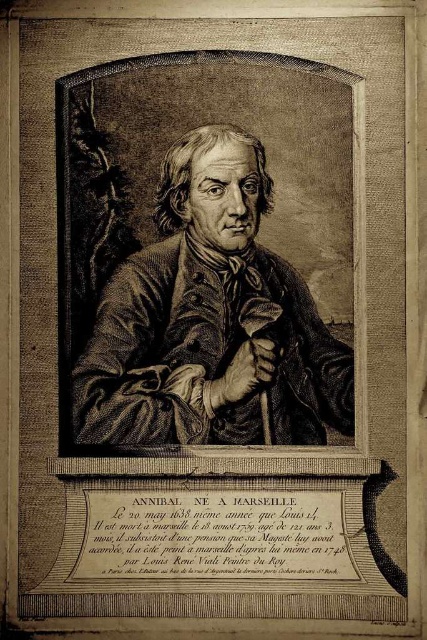
Question: Does etched paper portrait at center have a larger size compared to black paper text at center?

Choices:
 (A) no
 (B) yes

Answer: (B)

Question: Does etched paper portrait at center come in front of black paper text at center?

Choices:
 (A) no
 (B) yes

Answer: (A)

Question: Which point appears farthest from the camera in this image?

Choices:
 (A) (119, 332)
 (B) (169, 557)

Answer: (A)

Question: Does etched paper portrait at center appear under black paper text at center?

Choices:
 (A) yes
 (B) no

Answer: (B)